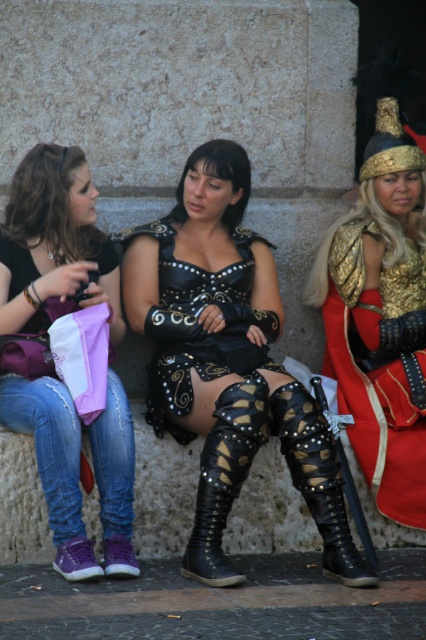
Based on the scene description, can you determine the spatial relationship between the denim jeans at lower left and the gold metallic armor at right? Specifically, which object is positioned to the left of the other?

The denim jeans at lower left are to the left of the gold metallic armor at right.

In the scene shown: You are a photographer trying to capture a candid shot of the gold metallic armor at right without including the denim jeans at lower left in the frame. Based on their positions, is this possible?

The denim jeans at lower left is in front of the gold metallic armor at right, so it would block the view. Therefore, it is not possible to capture the gold metallic armor at right without including the denim jeans at lower left in the frame.